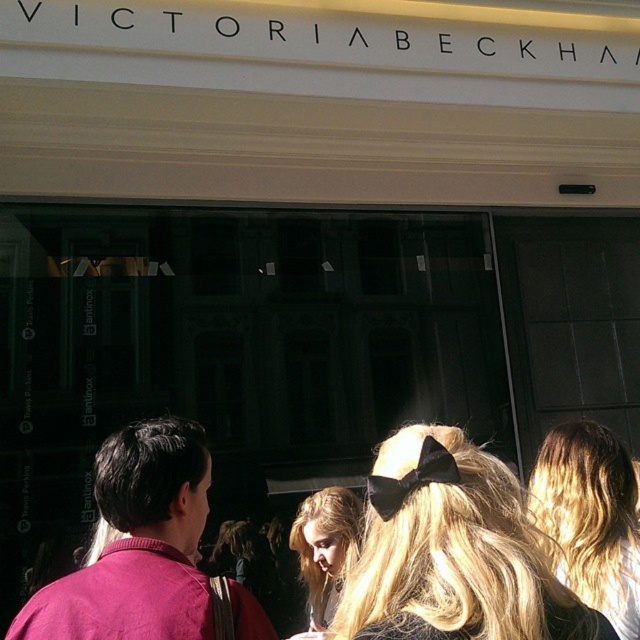
You are a photographer standing in front of the VICTORIA BECKHAM store. You notice a matte pink shirt at center and a black velvet bow at upper center. How far apart are these two items in centimeters?

The matte pink shirt at center is 58.81 centimeters from the black velvet bow at upper center.

You are standing at the entrance of the VICTORIA BECKHAM store and see two points marked on the ground. The first point is at coordinate point (145, 580) and the second is at point (433, 456). If you want to walk towards the point that is closer to the entrance, which coordinate should you head to?

Point (145, 580) is closer to the entrance because it is behind point (433, 456), meaning it is located nearer to the entrance area.